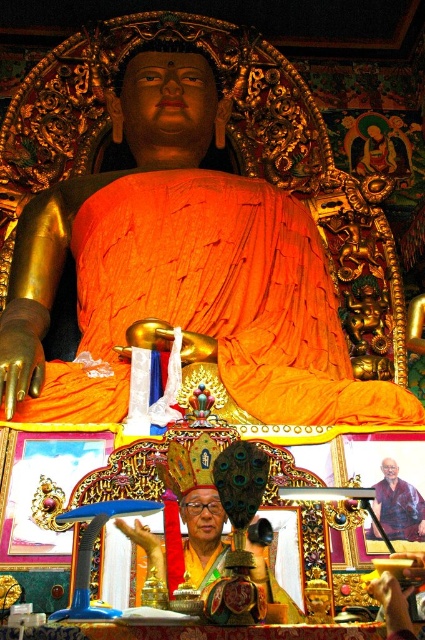
You are standing in the temple and want to place a small offering on the closest point between point (391, 525) and point (402, 612). Which point should you choose?

Point (391, 525) is closer to you than point (402, 612), so you should place the offering on point (391, 525).

You are standing at the entrance of the temple and want to take a photo of the golden statue of Buddha at the center. However, there is a point marked at coordinates point (x=163, y=292) blocking your view. Can you estimate whether this point is close enough to the statue for a clear photo?

The point (x=163, y=292) is 245.93 feet away from the viewer, so it is too far to block the view of the golden statue of Buddha at the center. You can take a clear photo.